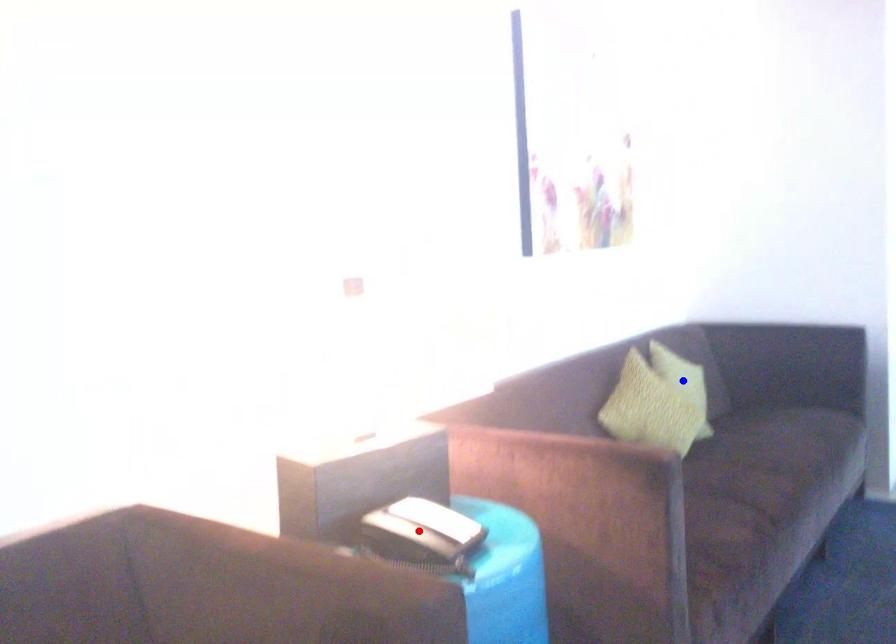
Question: In the image, two points are highlighted. Which point is nearer to the camera? Reply with the corresponding letter.

Choices:
 (A) blue point
 (B) red point

Answer: (B)